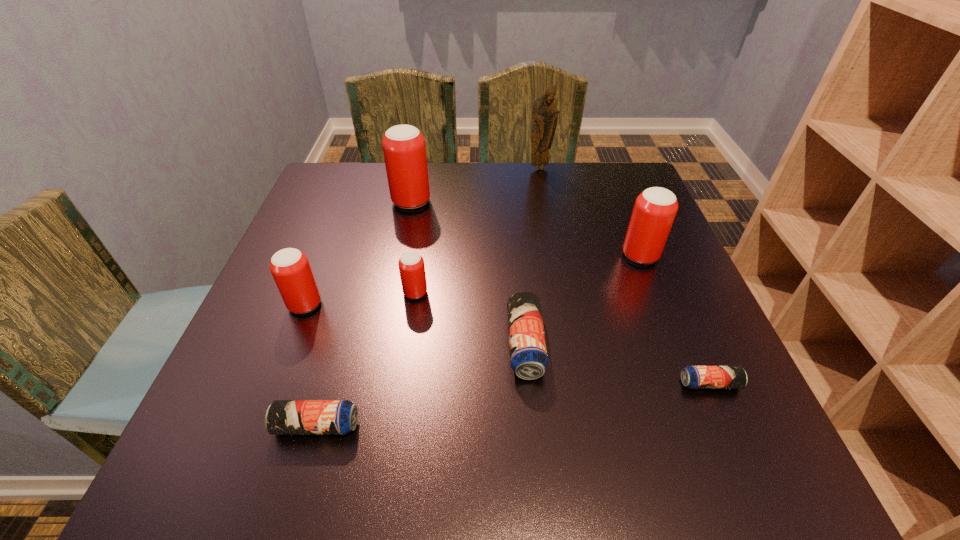
You are a GUI agent. You are given a task and a screenshot of the screen. Output one action in this format:
    pyautogui.click(x=<x>, y=<y>)
    Task: Click on the third object from right to left
    
    Given the screenshot: What is the action you would take?
    pyautogui.click(x=545, y=114)

You are a GUI agent. You are given a task and a screenshot of the screen. Output one action in this format:
    pyautogui.click(x=<x>, y=<y>)
    Task: Click on the farthest object
    
    Given the screenshot: What is the action you would take?
    pyautogui.click(x=545, y=114)

I want to click on the biggest red beer can, so click(x=404, y=149).

This screenshot has width=960, height=540. What are the coordinates of `the tallest beer can` in the screenshot? It's located at (404, 149).

What are the coordinates of `the rightmost red beer can` in the screenshot? It's located at (655, 208).

Locate an element on the screen. This screenshot has width=960, height=540. the sixth shortest object is located at coordinates [655, 208].

The height and width of the screenshot is (540, 960). I want to click on the third tallest beer can, so click(x=290, y=268).

At what (x,y) coordinates should I click in order to perform the action: click on the third biggest red beer can. Please return your answer as a coordinate pair (x, y). The image size is (960, 540). Looking at the image, I should click on (290, 268).

This screenshot has width=960, height=540. In order to click on the fourth shortest object in this screenshot , I will do coord(411,264).

Locate an element on the screen. The image size is (960, 540). the smallest red beer can is located at coordinates (411, 264).